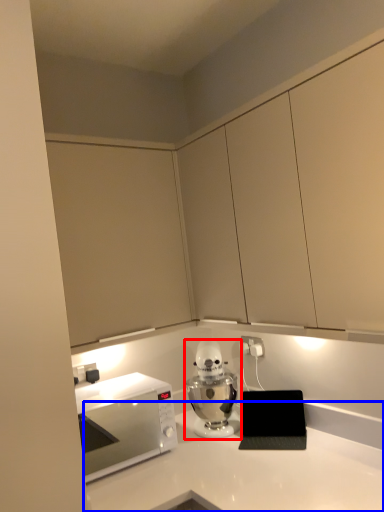
Question: Among these objects, which one is farthest to the camera, home appliance (highlighted by a red box) or countertop (highlighted by a blue box)?

Choices:
 (A) home appliance
 (B) countertop

Answer: (A)